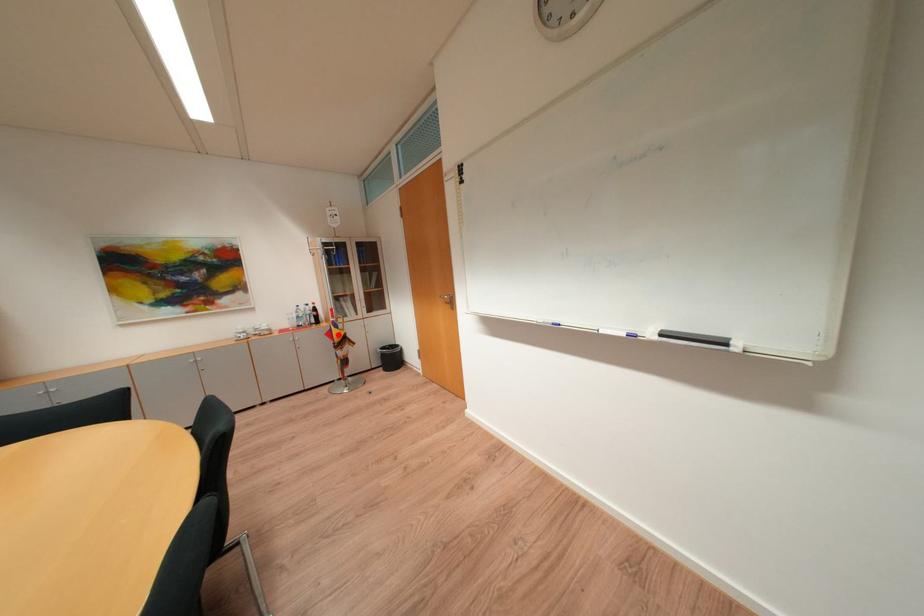
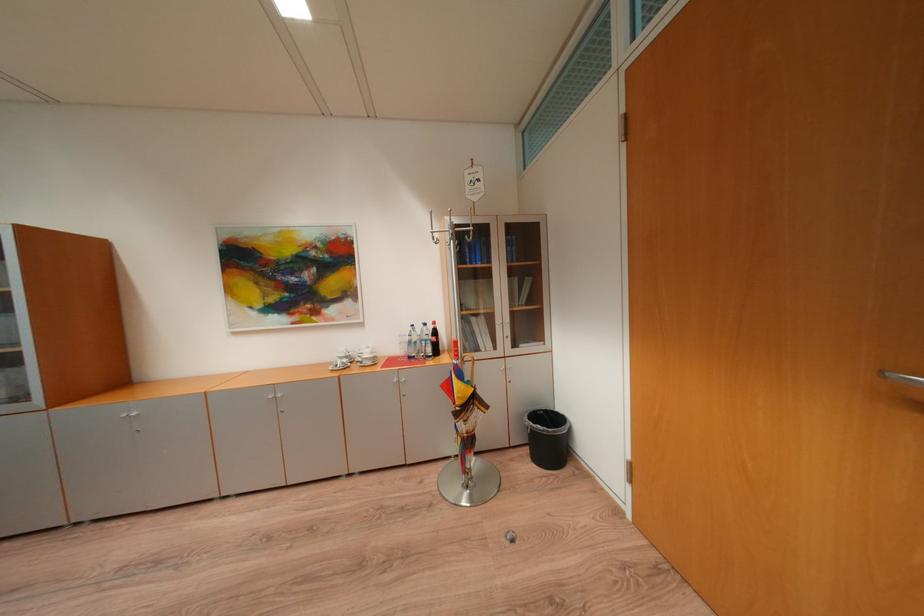
Where in the second image is the point corresponding to the highlighted location from the first image?

(456, 387)